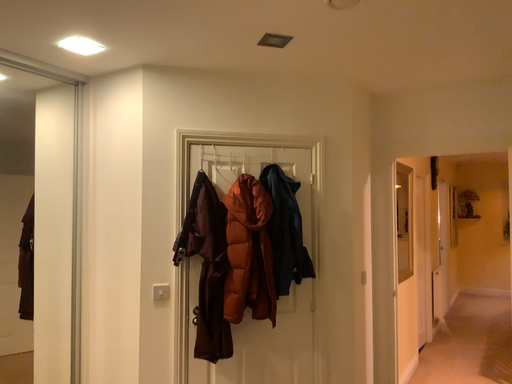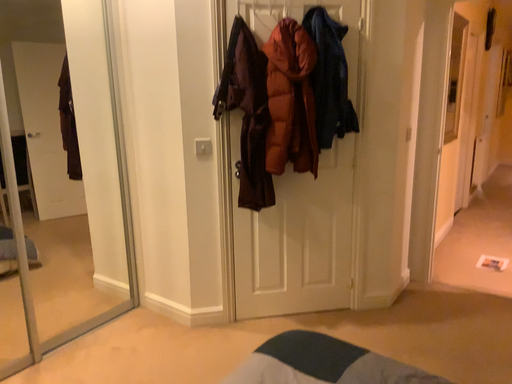
Question: Which way did the camera rotate in the video?

Choices:
 (A) rotated downward
 (B) rotated upward

Answer: (A)